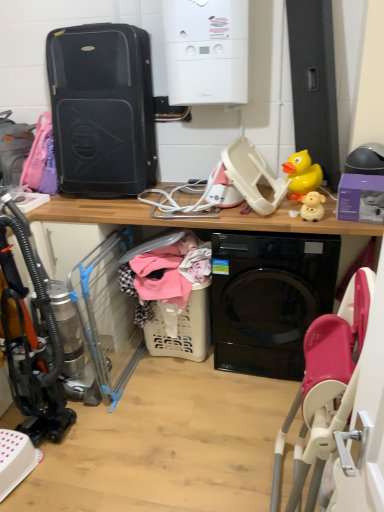
Image resolution: width=384 pixels, height=512 pixels. Identify the location of vacant area that is in front of white matte sheep at upper right, the 1th toy in the bottom-to-top sequence. click(x=331, y=224).